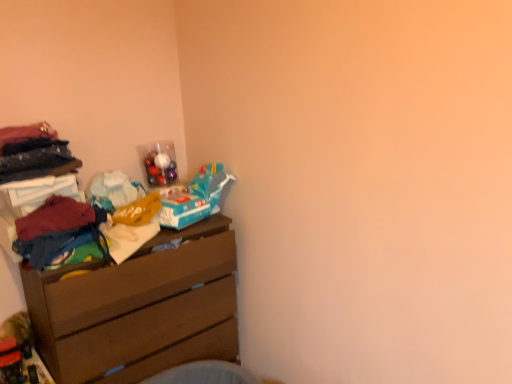
The height and width of the screenshot is (384, 512). Describe the element at coordinates (58, 230) in the screenshot. I see `multicolored fabric at left` at that location.

At what (x,y) coordinates should I click in order to perform the action: click on multicolored fabric at left. Please return your answer as a coordinate pair (x, y). The height and width of the screenshot is (384, 512). Looking at the image, I should click on (58, 230).

The image size is (512, 384). Describe the element at coordinates (139, 309) in the screenshot. I see `brown wooden chest of drawers at left` at that location.

This screenshot has width=512, height=384. I want to click on brown wooden chest of drawers at left, so click(x=139, y=309).

In order to face brown wooden chest of drawers at left, should I rotate leftwards or rightwards?

Rotate your view left by about 15.255°.

Find the location of `multicolored fabric at left`. multicolored fabric at left is located at coordinates (58, 230).

Which object is positioned more to the right, multicolored fabric at left or brown wooden chest of drawers at left?

From the viewer's perspective, brown wooden chest of drawers at left appears more on the right side.

Is multicolored fabric at left positioned in front of brown wooden chest of drawers at left?

Yes, it is in front of brown wooden chest of drawers at left.

Is point (100, 218) farther from camera compared to point (33, 277)?

Yes, it is behind point (33, 277).

From the image's perspective, would you say multicolored fabric at left is shown under brown wooden chest of drawers at left?

Incorrect, from the image's perspective, multicolored fabric at left is higher than brown wooden chest of drawers at left.

From a real-world perspective, which is physically above, multicolored fabric at left or brown wooden chest of drawers at left?

multicolored fabric at left is physically above.

Which of these two, multicolored fabric at left or brown wooden chest of drawers at left, is wider?

brown wooden chest of drawers at left.

Can you confirm if multicolored fabric at left is shorter than brown wooden chest of drawers at left?

Yes.

Considering the relative sizes of multicolored fabric at left and brown wooden chest of drawers at left in the image provided, is multicolored fabric at left bigger than brown wooden chest of drawers at left?

No.

Is brown wooden chest of drawers at left a part of multicolored fabric at left?

Actually, brown wooden chest of drawers at left is outside multicolored fabric at left.

Is multicolored fabric at left in contact with brown wooden chest of drawers at left?

No, multicolored fabric at left is not beside brown wooden chest of drawers at left.

In the scene shown: Is multicolored fabric at left turned away from brown wooden chest of drawers at left?

multicolored fabric at left is not turned away from brown wooden chest of drawers at left.

The image size is (512, 384). In the image, there is a multicolored fabric at left. What are the coordinates of `the chest of drawers below it (from the image's perspective)` in the screenshot? It's located at (139, 309).

Can you confirm if brown wooden chest of drawers at left is positioned to the right of multicolored fabric at left?

Indeed, brown wooden chest of drawers at left is positioned on the right side of multicolored fabric at left.

Considering their positions, is brown wooden chest of drawers at left located in front of or behind multicolored fabric at left?

brown wooden chest of drawers at left is behind multicolored fabric at left.

Which is closer to the camera, (53, 271) or (53, 222)?

The point (53, 271) is in front.

From the image's perspective, is brown wooden chest of drawers at left located beneath multicolored fabric at left?

Indeed, from the image's perspective, brown wooden chest of drawers at left is shown beneath multicolored fabric at left.

From a real-world perspective, who is located higher, brown wooden chest of drawers at left or multicolored fabric at left?

multicolored fabric at left is physically above.

Between brown wooden chest of drawers at left and multicolored fabric at left, which one has larger width?

With larger width is brown wooden chest of drawers at left.

Looking at this image, from their relative heights in the image, would you say brown wooden chest of drawers at left is taller or shorter than multicolored fabric at left?

brown wooden chest of drawers at left is taller than multicolored fabric at left.

In the scene shown: Is brown wooden chest of drawers at left bigger or smaller than multicolored fabric at left?

In the image, brown wooden chest of drawers at left appears to be larger than multicolored fabric at left.

Is brown wooden chest of drawers at left not within multicolored fabric at left?

That's correct, brown wooden chest of drawers at left is outside of multicolored fabric at left.

Would you say brown wooden chest of drawers at left is a long distance from multicolored fabric at left?

No, brown wooden chest of drawers at left is not far away from multicolored fabric at left.

Looking at this image, is brown wooden chest of drawers at left looking in the opposite direction of multicolored fabric at left?

No, multicolored fabric at left is not at the back of brown wooden chest of drawers at left.

The image size is (512, 384). Identify the location of clothing above the brown wooden chest of drawers at left (from the image's perspective). (58, 230).

I want to click on clothing in front of the brown wooden chest of drawers at left, so pos(58,230).

Where is `clothing on the left of the brown wooden chest of drawers at left`? clothing on the left of the brown wooden chest of drawers at left is located at coordinates (58, 230).